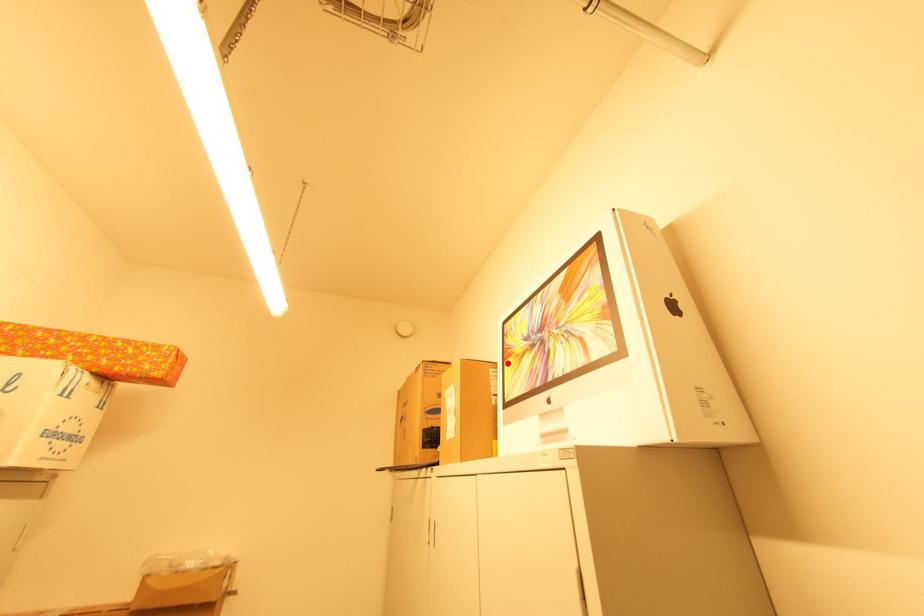
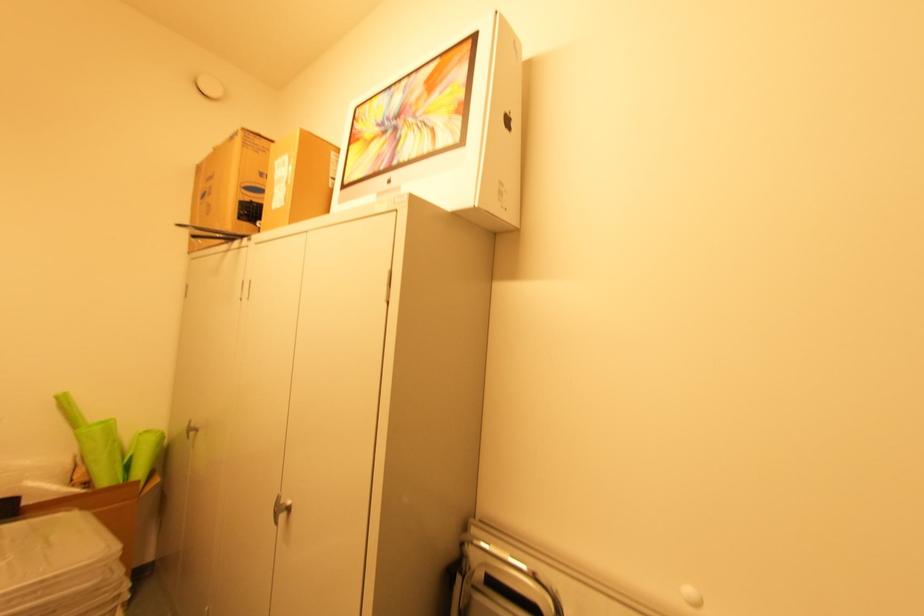
The point at the highlighted location is marked in the first image. Where is the corresponding point in the second image?

(353, 148)